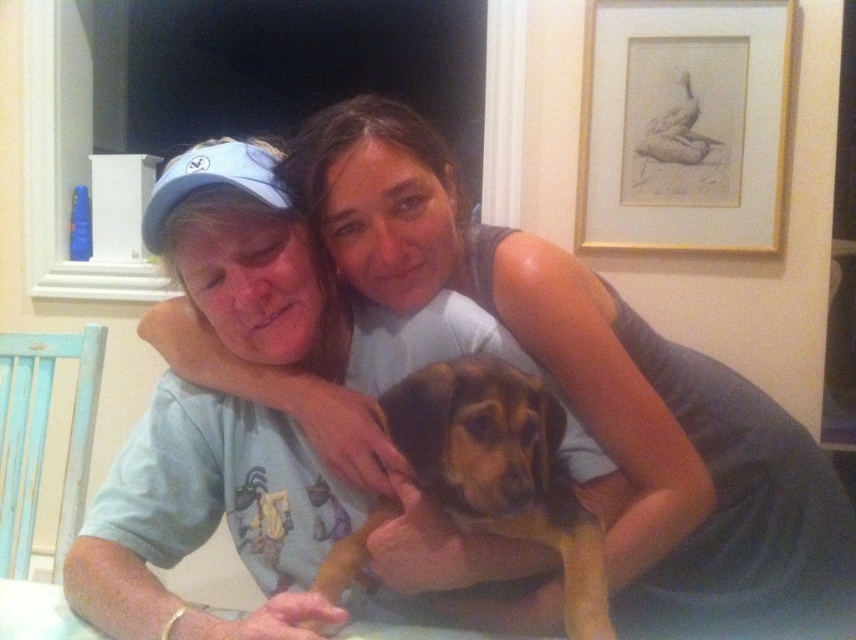
Question: Does gold framed drawing at upper right appear on the left side of brown fur dog at center?

Choices:
 (A) no
 (B) yes

Answer: (A)

Question: Does matte gray tank top at center appear under brown fur dog at center?

Choices:
 (A) no
 (B) yes

Answer: (A)

Question: Is gold framed drawing at upper right wider than brown fur dog at center?

Choices:
 (A) no
 (B) yes

Answer: (B)

Question: Which of the following is the closest to the observer?

Choices:
 (A) (736, 209)
 (B) (753, 445)
 (C) (468, 476)

Answer: (C)

Question: Which is nearer to the gold framed drawing at upper right?

Choices:
 (A) brown fur dog at center
 (B) matte gray tank top at center

Answer: (B)

Question: Which of the following is the farthest from the observer?

Choices:
 (A) brown fur dog at center
 (B) gold framed drawing at upper right

Answer: (B)